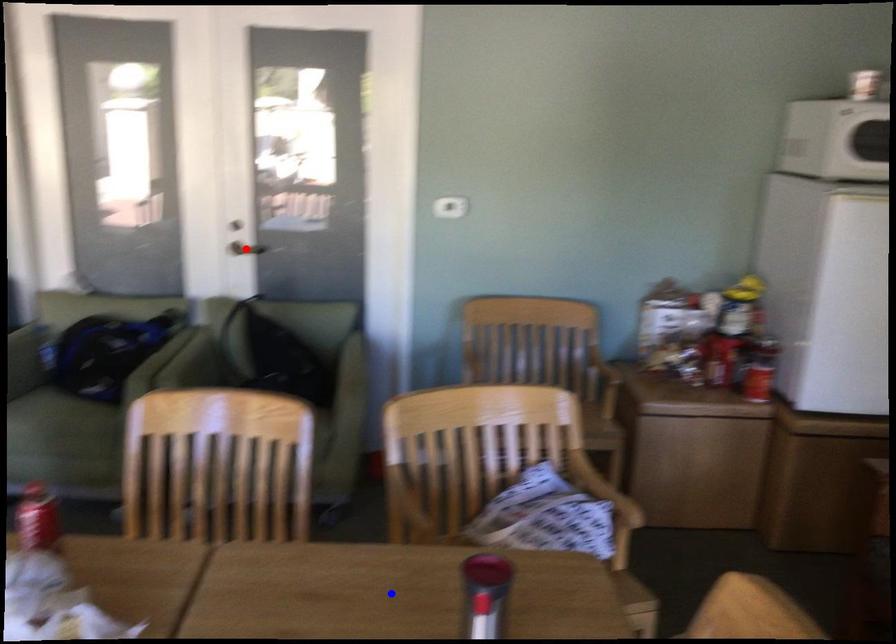
Question: In the image, two points are highlighted. Which point is nearer to the camera? Reply with the corresponding letter.

Choices:
 (A) blue point
 (B) red point

Answer: (A)